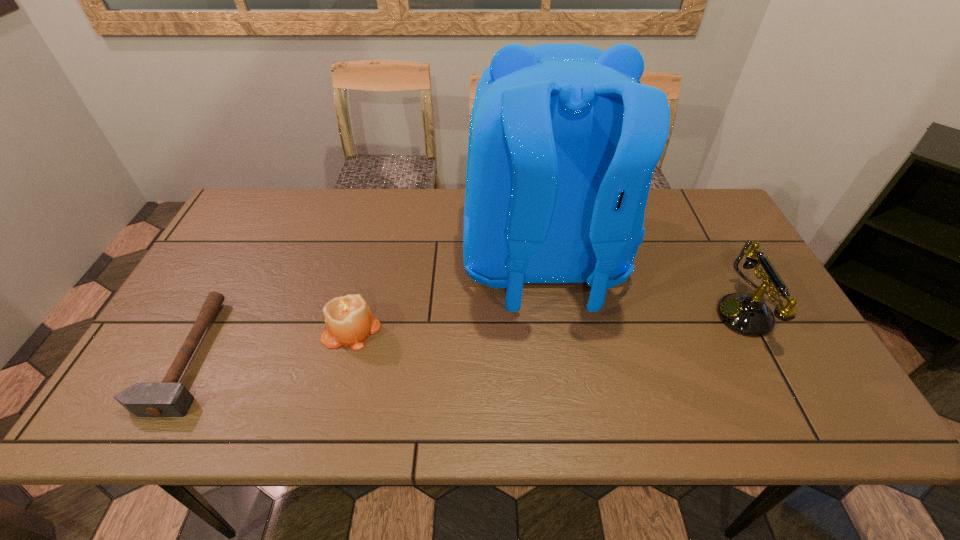
This screenshot has height=540, width=960. In order to click on backpack in this screenshot , I will do `click(563, 140)`.

Locate an element on the screen. The image size is (960, 540). the tallest object is located at coordinates (563, 140).

The height and width of the screenshot is (540, 960). In order to click on the rightmost object in this screenshot , I will do `click(747, 314)`.

Find the location of a particular element. telephone is located at coordinates (747, 314).

Where is `the second shortest object`? The height and width of the screenshot is (540, 960). the second shortest object is located at coordinates (349, 320).

The width and height of the screenshot is (960, 540). In order to click on the second object from left to right in this screenshot , I will do `click(349, 320)`.

You are a GUI agent. You are given a task and a screenshot of the screen. Output one action in this format:
    pyautogui.click(x=<x>, y=<y>)
    Task: Click on the shortest object
    This screenshot has width=960, height=540.
    Given the screenshot: What is the action you would take?
    pyautogui.click(x=169, y=398)

This screenshot has height=540, width=960. What are the coordinates of `the leftmost object` in the screenshot? It's located at (169, 398).

In order to click on blank area located on the back of the backpack in this screenshot , I will do `click(558, 368)`.

The image size is (960, 540). Identify the location of vacant space located on the dial of the rightmost object. (576, 314).